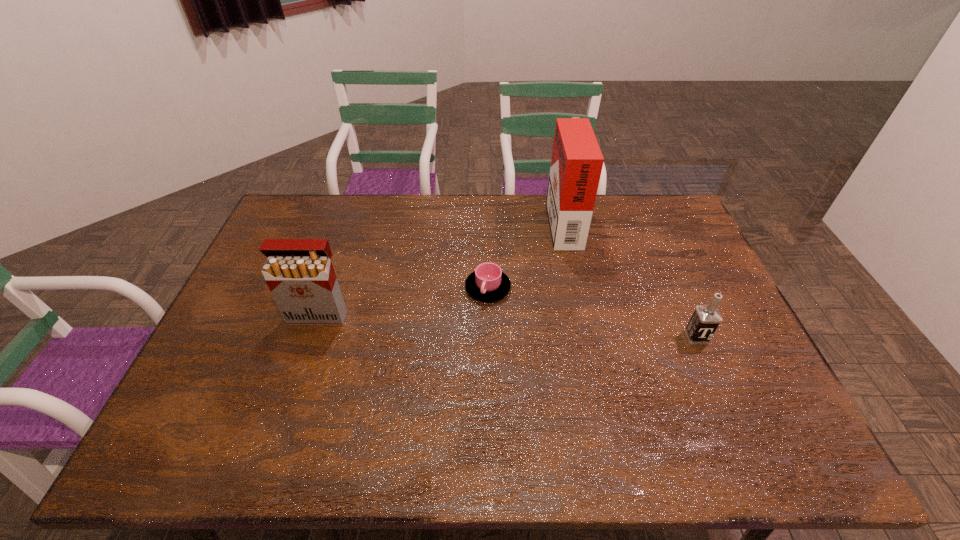
This screenshot has width=960, height=540. In order to click on vacant region at the far left corner of the desktop in this screenshot , I will do `click(310, 206)`.

Identify the location of vacant point located between the left cigarette case and the third nearest object. This screenshot has height=540, width=960. (403, 302).

I want to click on free spot between the third farthest object and the third object from left to right, so click(441, 268).

Find the location of a particular element. Image resolution: width=960 pixels, height=540 pixels. free space between the shorter cigarette case and the second shortest object is located at coordinates (507, 326).

Identify the location of empty location between the right cigarette case and the cup. tap(525, 254).

The width and height of the screenshot is (960, 540). Find the location of `vacant area that lies between the vodka and the taller cigarette case`. vacant area that lies between the vodka and the taller cigarette case is located at coordinates (630, 279).

Image resolution: width=960 pixels, height=540 pixels. Find the location of `free space between the second nearest object and the shortest object`. free space between the second nearest object and the shortest object is located at coordinates (403, 302).

This screenshot has height=540, width=960. Find the location of `blank region between the nearer cigarette case and the cup`. blank region between the nearer cigarette case and the cup is located at coordinates (403, 302).

Where is `free area in between the leftmost object and the shortest object`? The width and height of the screenshot is (960, 540). free area in between the leftmost object and the shortest object is located at coordinates (403, 302).

This screenshot has height=540, width=960. In order to click on unoccupied area between the taller cigarette case and the third farthest object in this screenshot , I will do `click(441, 268)`.